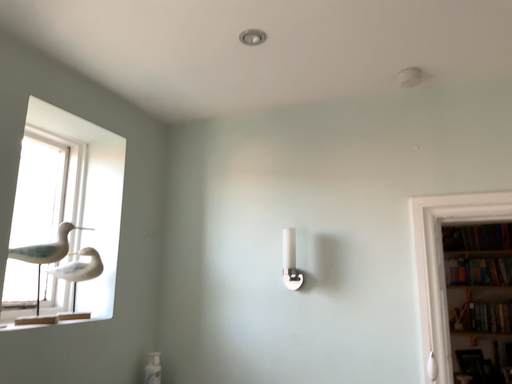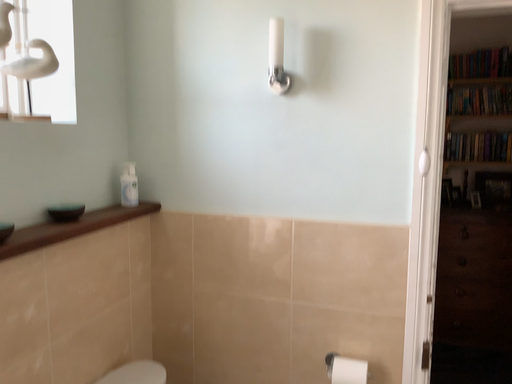
Question: How did the camera likely rotate when shooting the video?

Choices:
 (A) rotated upward
 (B) rotated downward

Answer: (B)